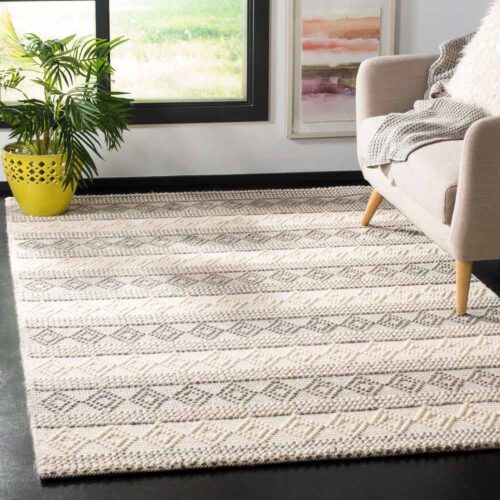
Find the location of a particular element. The image size is (500, 500). armrests is located at coordinates (387, 64), (480, 137).